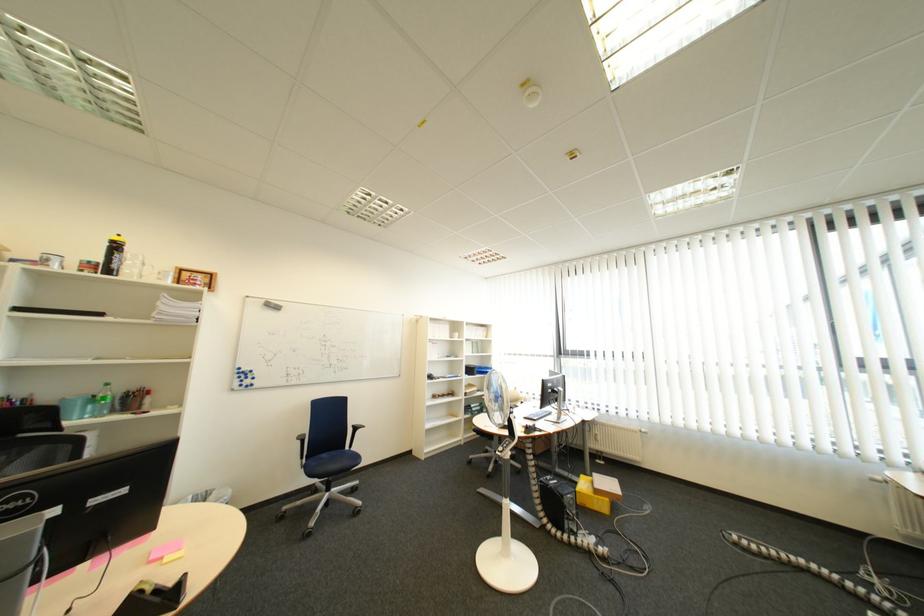
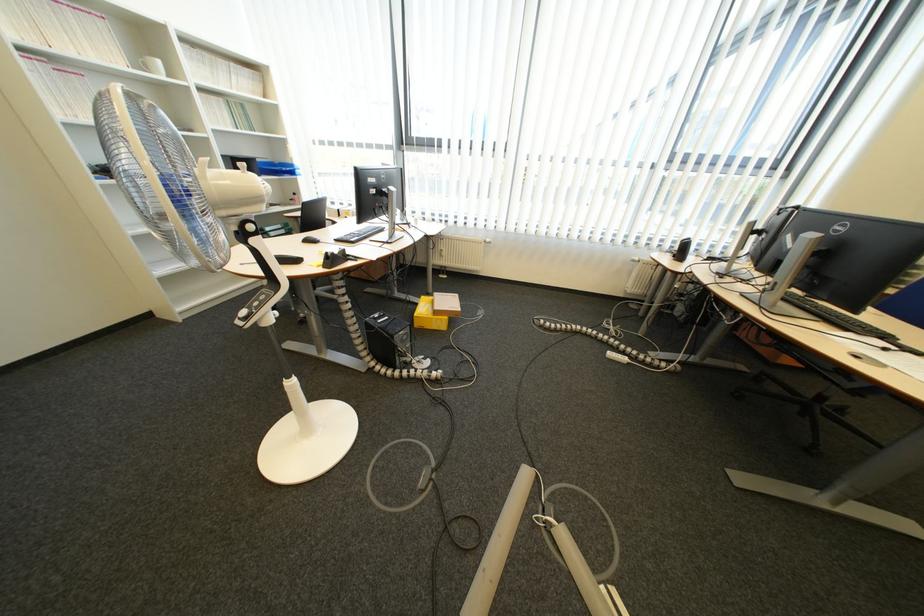
The point at (608, 476) is marked in the first image. Where is the corresponding point in the second image?

(448, 294)